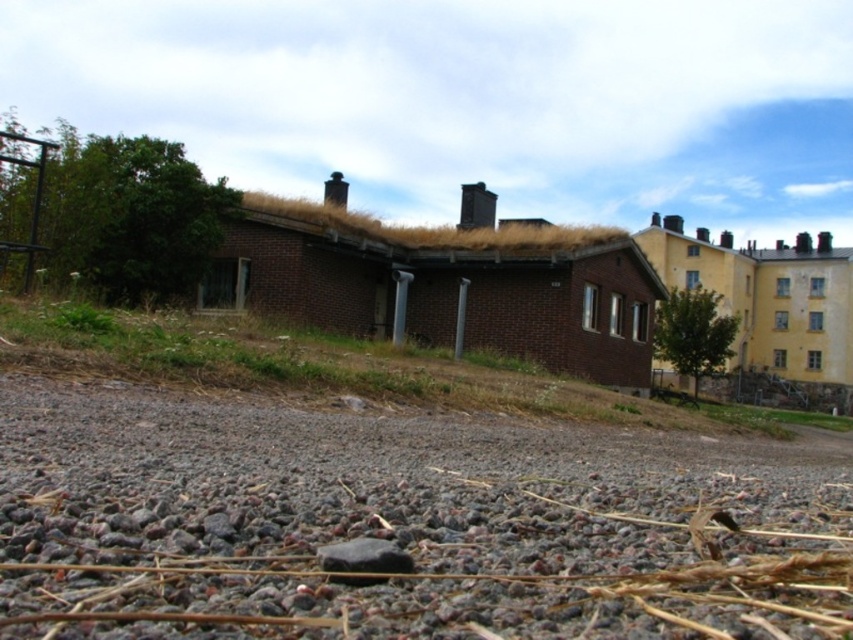
Is gray gravel at lower center positioned at the back of green leafy tree at right?

No.

This screenshot has width=853, height=640. Describe the element at coordinates (403, 525) in the screenshot. I see `gray gravel at lower center` at that location.

Which is in front, point (80, 600) or point (695, 385)?

Point (80, 600) is more forward.

At what (x,y) coordinates should I click in order to perform the action: click on gray gravel at lower center. Please return your answer as a coordinate pair (x, y). This screenshot has height=640, width=853. Looking at the image, I should click on (403, 525).

In the scene shown: Is green leafy tree at right smaller than black smooth rock at lower center?

No, green leafy tree at right is not smaller than black smooth rock at lower center.

Is point (683, 365) closer to viewer compared to point (326, 548)?

That is False.

The width and height of the screenshot is (853, 640). Find the location of `green leafy tree at right`. green leafy tree at right is located at coordinates 693,333.

Can you confirm if gray gravel at lower center is thinner than black smooth rock at lower center?

No, gray gravel at lower center is not thinner than black smooth rock at lower center.

Between point (190, 497) and point (338, 548), which one is positioned in front?

Point (338, 548)

What do you see at coordinates (403, 525) in the screenshot? This screenshot has width=853, height=640. I see `gray gravel at lower center` at bounding box center [403, 525].

Image resolution: width=853 pixels, height=640 pixels. What are the coordinates of `gray gravel at lower center` in the screenshot? It's located at (403, 525).